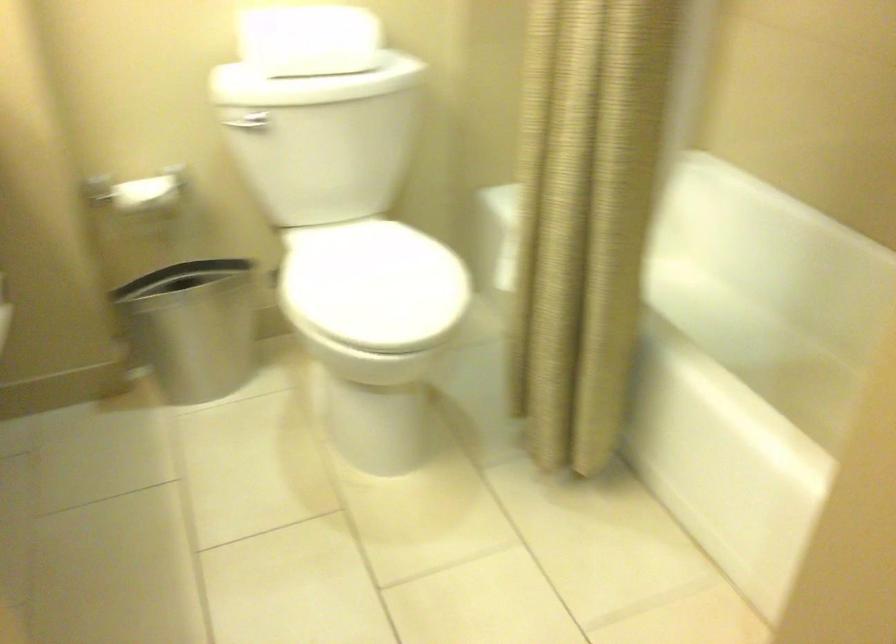
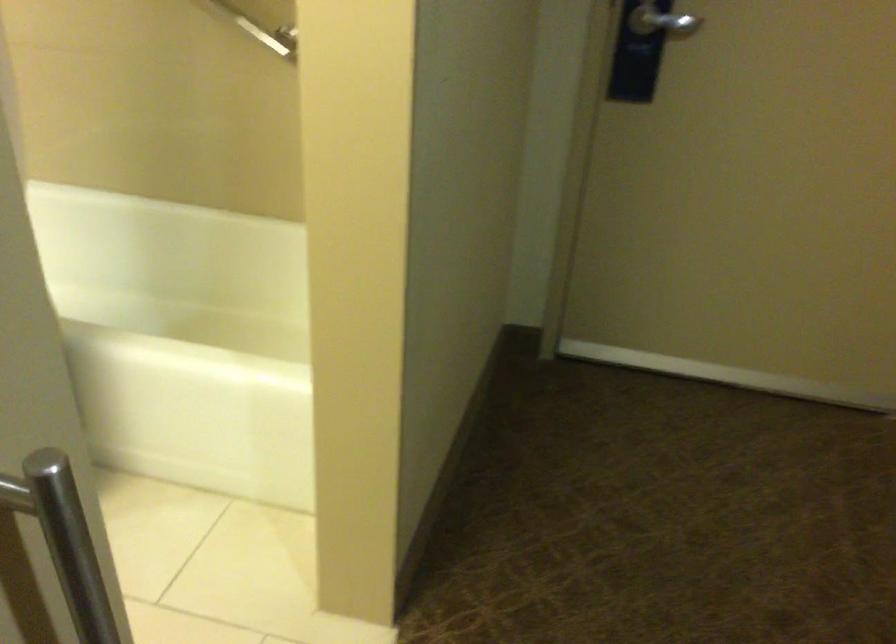
Question: The first image is from the beginning of the video and the second image is from the end. How did the camera likely rotate when shooting the video?

Choices:
 (A) Left
 (B) Right
 (C) Up
 (D) Down

Answer: (B)